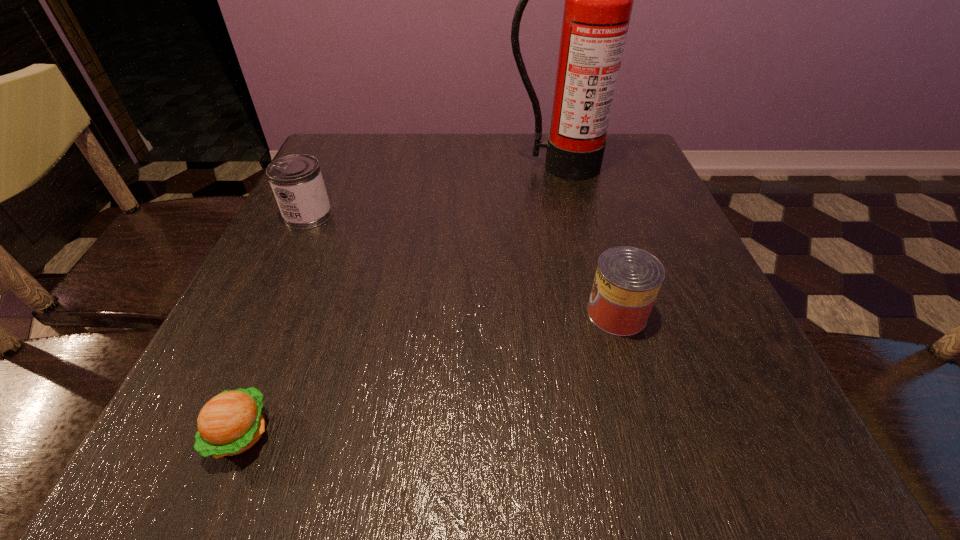
The image size is (960, 540). What are the coordinates of `the tallest object` in the screenshot? It's located at (598, 3).

Find the location of a particular element. fire extinguisher is located at coordinates (598, 3).

Identify the location of the left can. pyautogui.click(x=296, y=180).

Locate an element on the screen. the farther can is located at coordinates (296, 180).

Where is `the third farthest object`? The width and height of the screenshot is (960, 540). the third farthest object is located at coordinates (627, 280).

At what (x,y) coordinates should I click in order to perform the action: click on the nearer can. Please return your answer as a coordinate pair (x, y). Looking at the image, I should click on (627, 280).

Identify the location of hamburger. The width and height of the screenshot is (960, 540). (230, 423).

This screenshot has height=540, width=960. What are the coordinates of `the nearest object` in the screenshot? It's located at (230, 423).

What are the coordinates of `vacant space situated 0.400m on the front-facing side of the fire extinguisher` in the screenshot? It's located at (595, 312).

Locate an element on the screen. Image resolution: width=960 pixels, height=540 pixels. free space located 0.270m on the back of the left can is located at coordinates (343, 142).